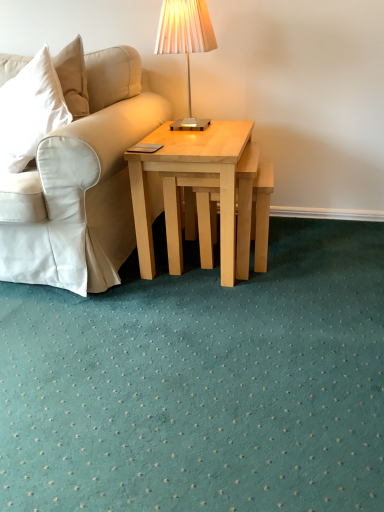
Question: Is light wood stool at center completely or partially inside natural wood coffee table at center?

Choices:
 (A) no
 (B) yes

Answer: (B)

Question: Are natural wood coffee table at center and light wood stool at center making contact?

Choices:
 (A) no
 (B) yes

Answer: (A)

Question: Is natural wood coffee table at center closer to camera compared to light wood stool at center?

Choices:
 (A) no
 (B) yes

Answer: (B)

Question: Considering the relative sizes of natural wood coffee table at center and light wood stool at center in the image provided, is natural wood coffee table at center thinner than light wood stool at center?

Choices:
 (A) no
 (B) yes

Answer: (A)

Question: Considering the relative sizes of natural wood coffee table at center and light wood stool at center in the image provided, is natural wood coffee table at center shorter than light wood stool at center?

Choices:
 (A) no
 (B) yes

Answer: (A)

Question: From a real-world perspective, is natural wood coffee table at center physically above light wood stool at center?

Choices:
 (A) no
 (B) yes

Answer: (B)

Question: From the image's perspective, is metallic silver table lamp at upper center over natural wood coffee table at center?

Choices:
 (A) no
 (B) yes

Answer: (B)

Question: Does metallic silver table lamp at upper center have a smaller size compared to natural wood coffee table at center?

Choices:
 (A) yes
 (B) no

Answer: (A)

Question: Is natural wood coffee table at center inside metallic silver table lamp at upper center?

Choices:
 (A) yes
 (B) no

Answer: (B)

Question: Does metallic silver table lamp at upper center have a larger size compared to natural wood coffee table at center?

Choices:
 (A) yes
 (B) no

Answer: (B)

Question: Is the depth of metallic silver table lamp at upper center greater than that of natural wood coffee table at center?

Choices:
 (A) yes
 (B) no

Answer: (A)

Question: Does metallic silver table lamp at upper center have a lesser width compared to natural wood coffee table at center?

Choices:
 (A) no
 (B) yes

Answer: (B)

Question: From the image's perspective, is light wood stool at center below natural wood coffee table at center?

Choices:
 (A) no
 (B) yes

Answer: (B)